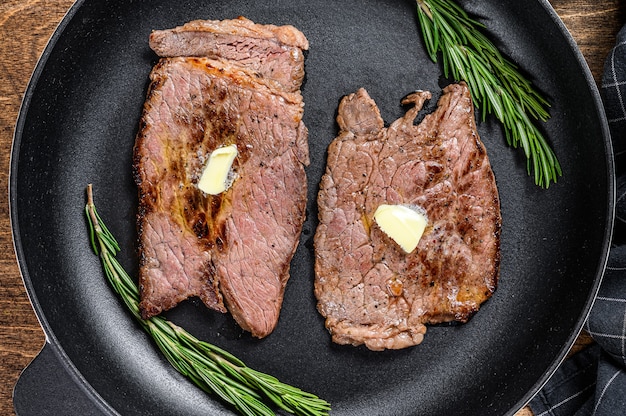
This screenshot has width=626, height=416. Identify the location of hand towel that is grey and black checked. 611,336.